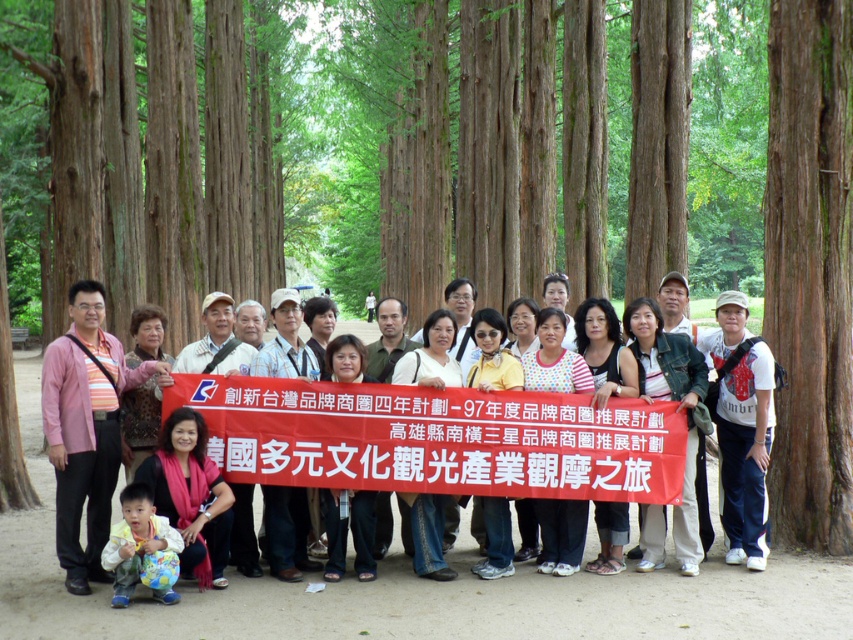
Which is behind, point (753, 420) or point (148, 550)?

Positioned behind is point (753, 420).

Does white cotton shirt at center have a lesser height compared to light blue fabric at lower left?

Incorrect, white cotton shirt at center's height does not fall short of light blue fabric at lower left's.

Between point (730, 410) and point (158, 528), which one is positioned behind?

Point (730, 410)

At what (x,y) coordinates should I click in order to perform the action: click on white cotton shirt at center. Please return your answer as a coordinate pair (x, y). This screenshot has height=640, width=853. Looking at the image, I should click on (741, 428).

Which is in front, point (288, 460) or point (746, 516)?

Point (288, 460)

Between point (363, 413) and point (767, 380), which one is positioned behind?

The point (767, 380) is behind.

This screenshot has height=640, width=853. In order to click on matte yellow sign at center in this screenshot , I will do `click(434, 438)`.

You are a GUI agent. You are given a task and a screenshot of the screen. Output one action in this format:
    pyautogui.click(x=<x>, y=<y>)
    Task: Click on the matte yellow sign at center
    This screenshot has width=853, height=640.
    Given the screenshot: What is the action you would take?
    pyautogui.click(x=434, y=438)

Looking at this image, can you confirm if matte yellow sign at center is positioned to the left of light blue fabric at lower left?

No, matte yellow sign at center is not to the left of light blue fabric at lower left.

Where is `matte yellow sign at center`? matte yellow sign at center is located at coordinates (434, 438).

Find the location of `matte yellow sign at center`. matte yellow sign at center is located at coordinates (434, 438).